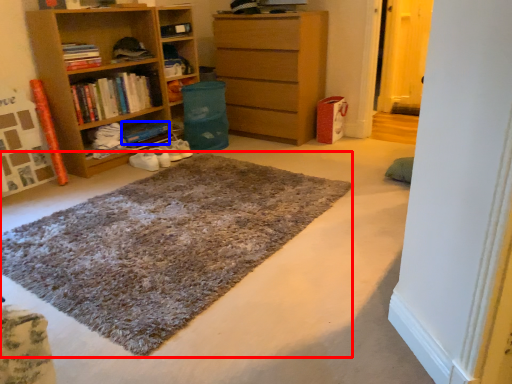
Question: Which of the following is the closest to the observer, doormat (highlighted by a red box) or book (highlighted by a blue box)?

Choices:
 (A) doormat
 (B) book

Answer: (A)